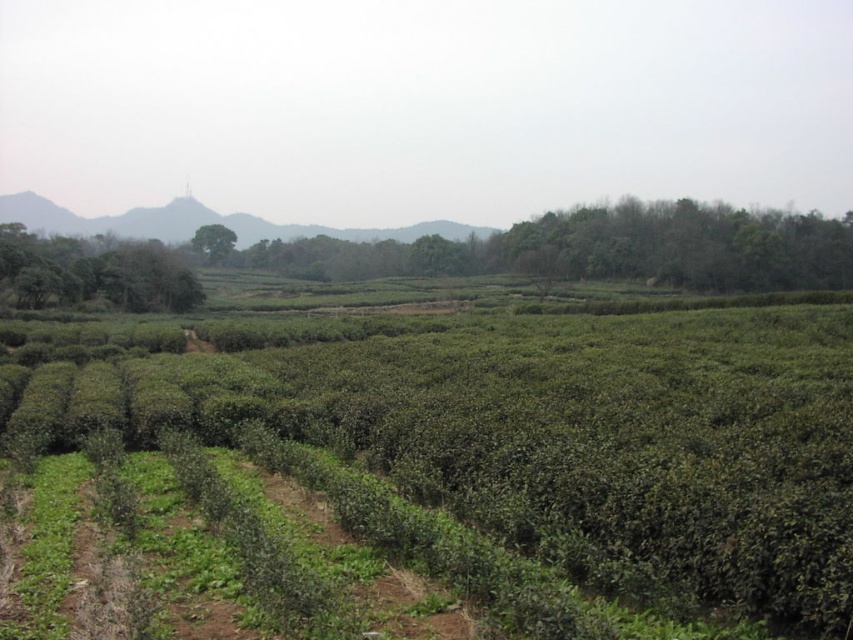
You are standing at the camera position looking at the green leafy tree at left. If you walk straight towards it for 200 feet, will you reach the tree?

The green leafy tree at left is 231.82 feet away from the camera. Walking 200 feet towards it would leave you 31.82 feet short of reaching the tree.

You are a landscape architect designing a new tea plantation. You have two green leafy trees to place in the scene. The green leafy tree at left and the green leafy tree at center. Which tree should you place closer to the boundary of the plantation to provide better shade?

The green leafy tree at left is bigger than the green leafy tree at center, so you should place the green leafy tree at left closer to the boundary to provide better shade due to its larger size.